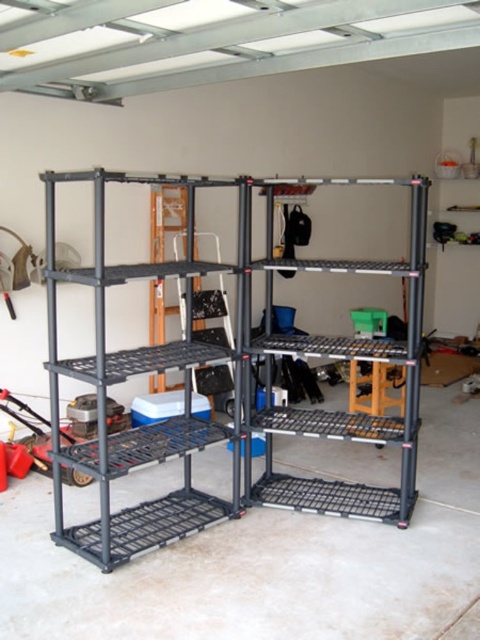
Question: Is black metal shelf at center thinner than black wire shelving unit at center?

Choices:
 (A) yes
 (B) no

Answer: (A)

Question: Can you confirm if black metal shelf at center is smaller than black wire shelving unit at center?

Choices:
 (A) yes
 (B) no

Answer: (A)

Question: Which point appears farthest from the camera in this image?

Choices:
 (A) (412, 332)
 (B) (48, 376)

Answer: (B)

Question: Considering the relative positions of black metal shelf at center and black wire shelving unit at center in the image provided, where is black metal shelf at center located with respect to black wire shelving unit at center?

Choices:
 (A) below
 (B) above

Answer: (A)